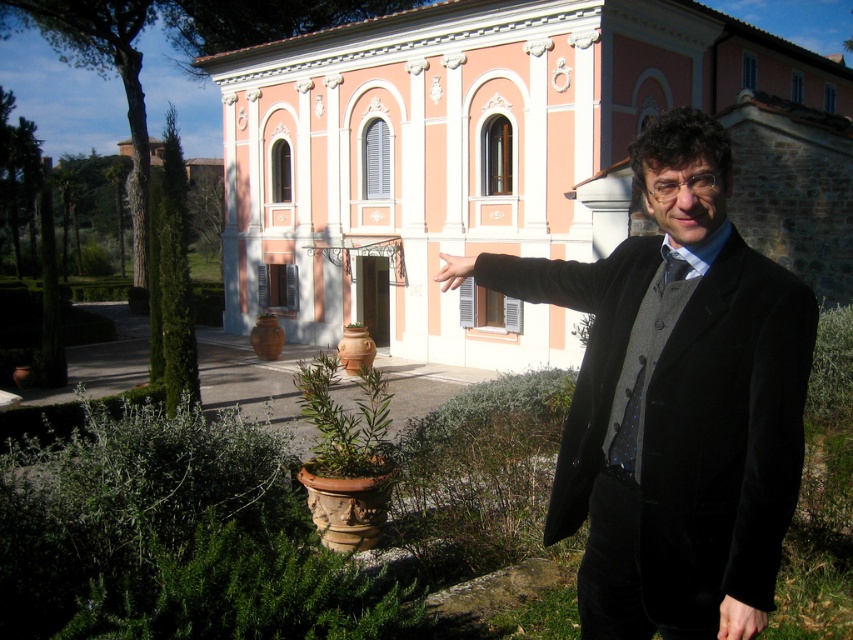
Question: Can you confirm if pink stucco building at center is bigger than velvet black coat at center?

Choices:
 (A) no
 (B) yes

Answer: (B)

Question: Among these objects, which one is nearest to the camera?

Choices:
 (A) smooth skin hand at lower right
 (B) smooth skin hand at center
 (C) velvet black coat at center
 (D) pink stucco building at center

Answer: (C)

Question: Is the position of pink stucco building at center less distant than that of smooth skin hand at lower right?

Choices:
 (A) yes
 (B) no

Answer: (B)

Question: Can you confirm if velvet black coat at center is positioned below smooth skin hand at lower right?

Choices:
 (A) yes
 (B) no

Answer: (B)

Question: Which object is closer to the camera taking this photo?

Choices:
 (A) smooth skin hand at lower right
 (B) pink stucco building at center

Answer: (A)

Question: Which of the following is the closest to the observer?

Choices:
 (A) velvet black coat at center
 (B) smooth skin hand at lower right
 (C) pink stucco building at center
 (D) smooth skin hand at center

Answer: (A)